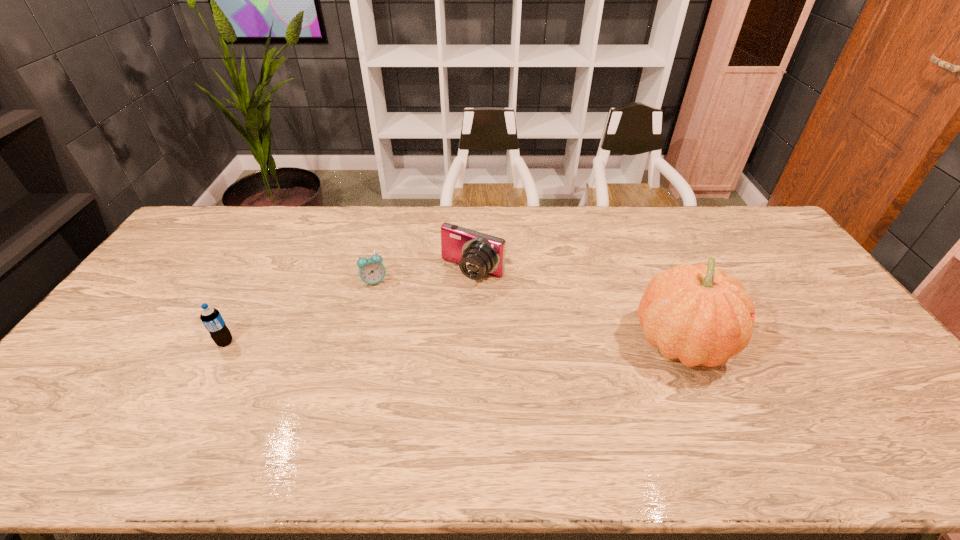
Locate an element on the screen. soda bottle is located at coordinates (211, 318).

Find the location of `the tallest object`. the tallest object is located at coordinates (697, 314).

The width and height of the screenshot is (960, 540). Identify the location of the rightmost object. (697, 314).

Locate an element on the screen. The height and width of the screenshot is (540, 960). the second object from right to left is located at coordinates (478, 254).

At what (x,y) coordinates should I click in order to perform the action: click on alarm clock. Please return your answer as a coordinate pair (x, y). Looking at the image, I should click on (371, 270).

The width and height of the screenshot is (960, 540). Identify the location of the third object from right to left. (371, 270).

The width and height of the screenshot is (960, 540). I want to click on free space located on the right of the soda bottle, so click(288, 342).

This screenshot has height=540, width=960. I want to click on vacant space located on the carved face of the pumpkin, so click(788, 342).

Where is `vacant space located on the front-facing side of the second object from right to left`? The width and height of the screenshot is (960, 540). vacant space located on the front-facing side of the second object from right to left is located at coordinates (419, 341).

I want to click on vacant space situated on the front-facing side of the second object from right to left, so click(442, 310).